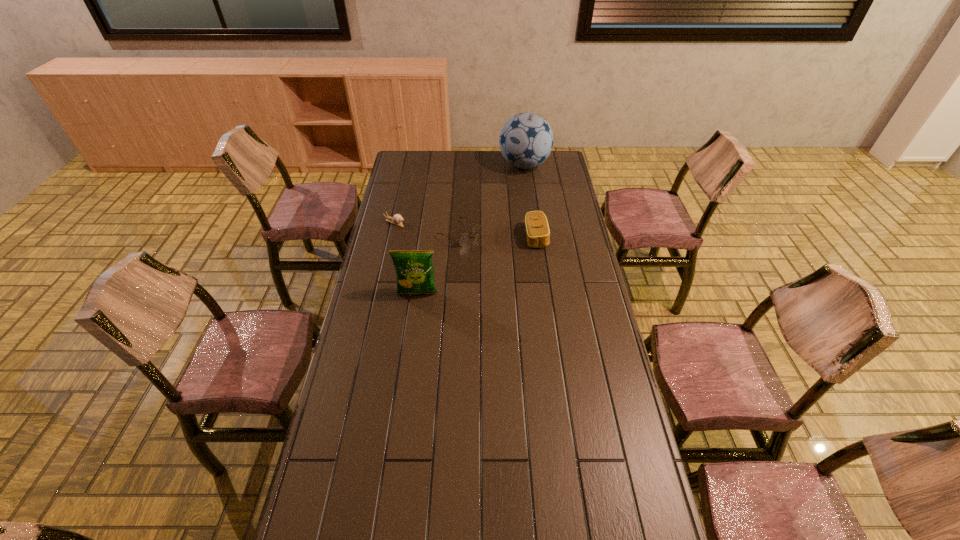
Find the location of `vacant space on the desktop that is between the crisp (potato chip) and the clutch bag and is positioned on the lenses of the fourth tallest object`. vacant space on the desktop that is between the crisp (potato chip) and the clutch bag and is positioned on the lenses of the fourth tallest object is located at coordinates coord(497,255).

Locate an element on the screen. vacant space on the desktop that is between the crisp (potato chip) and the clutch bag and is positioned on the side with brand of the soccer ball is located at coordinates (468, 269).

Image resolution: width=960 pixels, height=540 pixels. In order to click on vacant spot on the desktop that is between the crisp (potato chip) and the third tallest object and is positioned on the shell of the escargot in this screenshot , I will do `click(490, 259)`.